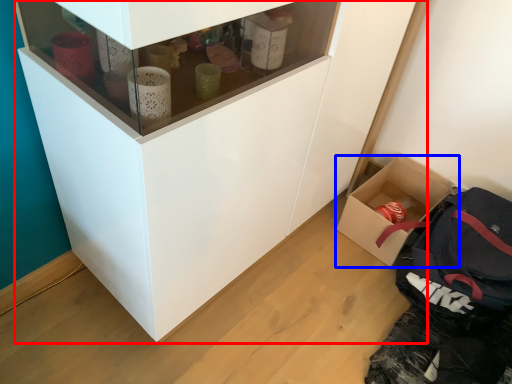
Question: Which of the following is the farthest to the observer, cupboard (highlighted by a red box) or box (highlighted by a blue box)?

Choices:
 (A) cupboard
 (B) box

Answer: (B)